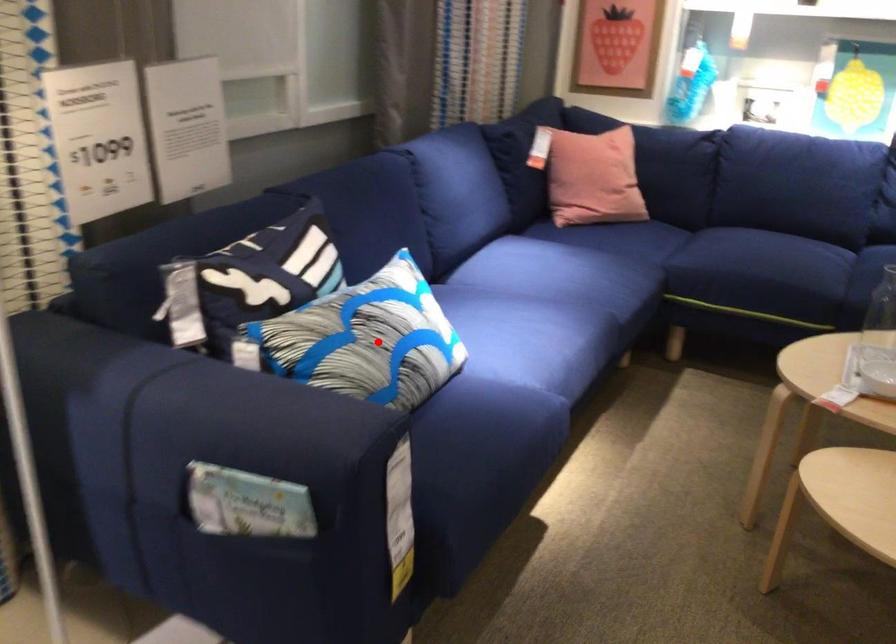
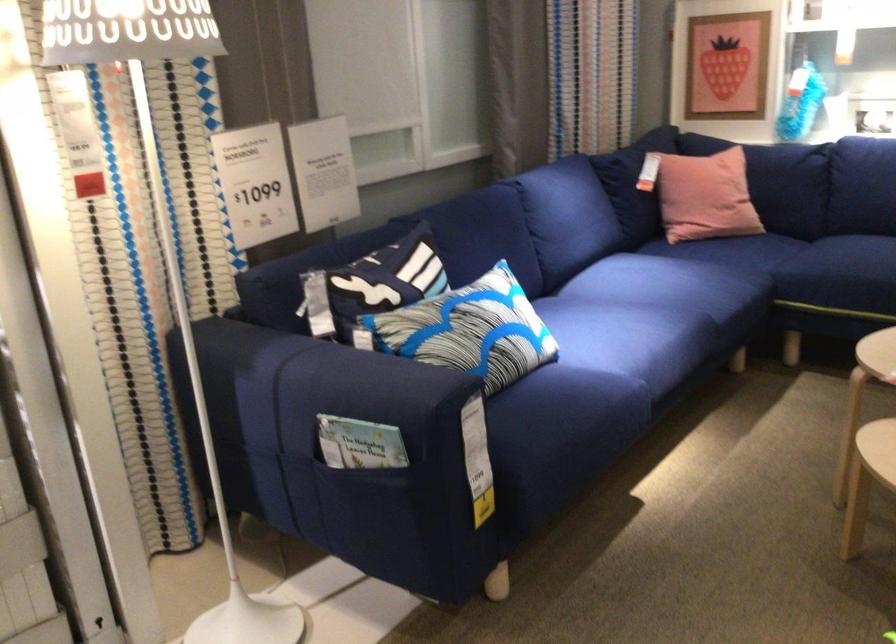
Find the pixel in the second image that matches the highlighted location in the first image.

(470, 330)